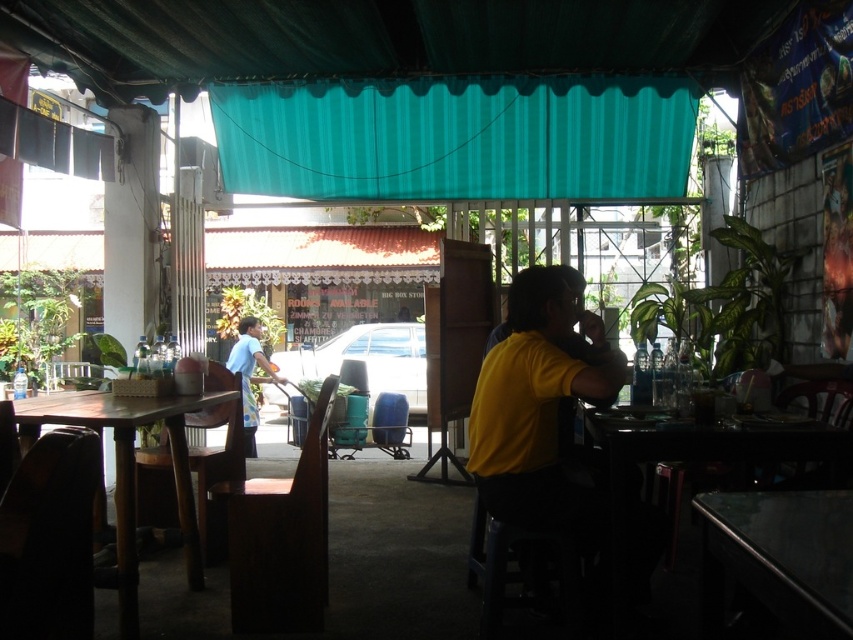
You are a customer at the outdoor seating area and want to sit down. The brown wooden chair at left and the wooden table at left are in your way. Which object should you move first to reach the seating area?

The brown wooden chair at left is much taller than the wooden table at left, so you should move the wooden table at left first since it is lower and easier to move out of the way.

You are a customer at this outdoor seating area and want to sit down. There is a brown wooden chair at left and a wooden table at left. Can you tell me which one is more suitable for sitting?

The brown wooden chair at left is more suitable for sitting because it is a chair designed for seating, while the wooden table at left is meant for placing items like dishes or drinks.

You are standing in the outdoor seating area and want to place a small potted plant between the two points marked as point (287,506) and point (210,401). Which point should the plant be closer to in order to be nearer to the viewer?

The plant should be placed closer to point (287,506) because it is closer to the viewer than point (210,401).